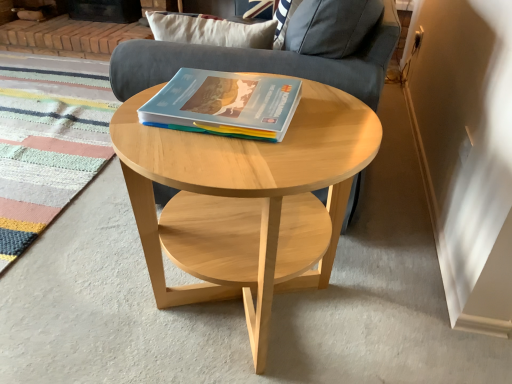
This screenshot has width=512, height=384. Describe the element at coordinates (281, 52) in the screenshot. I see `gray fabric armchair at center` at that location.

Find the location of a particular element. multicolored woven mat at lower left is located at coordinates (48, 140).

Identify the location of matte plastic book at center. (224, 104).

Are multicolored woven mat at lower left and gray fabric armchair at center located far from each other?

Yes.

Which of these two, multicolored woven mat at lower left or gray fabric armchair at center, stands taller?

gray fabric armchair at center is taller.

Is multicolored woven mat at lower left facing towards gray fabric armchair at center?

No, multicolored woven mat at lower left does not turn towards gray fabric armchair at center.

In terms of size, does multicolored woven mat at lower left appear bigger or smaller than gray fabric armchair at center?

Considering their sizes, multicolored woven mat at lower left takes up less space than gray fabric armchair at center.

Considering the positions of objects matte plastic book at center and multicolored woven mat at lower left in the image provided, who is in front, matte plastic book at center or multicolored woven mat at lower left?

Positioned in front is matte plastic book at center.

Who is taller, matte plastic book at center or multicolored woven mat at lower left?

matte plastic book at center is taller.

Between matte plastic book at center and multicolored woven mat at lower left, which one appears on the right side from the viewer's perspective?

matte plastic book at center is more to the right.

From the picture: Is natural wood coffee table at center oriented away from matte plastic book at center?

No, natural wood coffee table at center's orientation is not away from matte plastic book at center.

From a real-world perspective, is natural wood coffee table at center beneath matte plastic book at center?

Yes.

Between multicolored woven mat at lower left and natural wood coffee table at center, which one has smaller size?

multicolored woven mat at lower left.

Is multicolored woven mat at lower left facing away from natural wood coffee table at center?

No.

Is multicolored woven mat at lower left wider than natural wood coffee table at center?

Yes, multicolored woven mat at lower left is wider than natural wood coffee table at center.

Which object is more forward, multicolored woven mat at lower left or natural wood coffee table at center?

natural wood coffee table at center.

From the image's perspective, who appears lower, gray fabric armchair at center or matte plastic book at center?

From the image's view, matte plastic book at center is below.

Identify the location of book above the gray fabric armchair at center (from a real-world perspective). This screenshot has width=512, height=384. (224, 104).

Can you confirm if gray fabric armchair at center is positioned to the right of matte plastic book at center?

Indeed, gray fabric armchair at center is positioned on the right side of matte plastic book at center.

From the picture: Does gray fabric armchair at center have a greater height compared to matte plastic book at center?

Correct, gray fabric armchair at center is much taller as matte plastic book at center.

Which object is wider, natural wood coffee table at center or gray fabric armchair at center?

With larger width is gray fabric armchair at center.

From the image's perspective, between natural wood coffee table at center and gray fabric armchair at center, who is located below?

natural wood coffee table at center.

This screenshot has width=512, height=384. I want to click on coffee table on the left of gray fabric armchair at center, so click(246, 202).

Does natural wood coffee table at center come in front of gray fabric armchair at center?

Yes, natural wood coffee table at center is in front of gray fabric armchair at center.

Is matte plastic book at center inside the boundaries of gray fabric armchair at center, or outside?

matte plastic book at center is spatially situated outside gray fabric armchair at center.

Which is nearer, (153, 126) or (153, 52)?

Point (153, 126) is positioned closer to the camera compared to point (153, 52).

From a real-world perspective, who is located higher, matte plastic book at center or gray fabric armchair at center?

matte plastic book at center, from a real-world perspective.

Based on their sizes in the image, would you say matte plastic book at center is bigger or smaller than gray fabric armchair at center?

matte plastic book at center is smaller than gray fabric armchair at center.

Locate an element on the screen. This screenshot has height=384, width=512. mat below the gray fabric armchair at center (from the image's perspective) is located at coordinates (48, 140).

Where is `mat that is above the matte plastic book at center (from the image's perspective)`? mat that is above the matte plastic book at center (from the image's perspective) is located at coordinates (48, 140).

From the image, which object appears to be farther from matte plastic book at center, natural wood coffee table at center or gray fabric armchair at center?

The object further to matte plastic book at center is gray fabric armchair at center.

In the scene shown: Which object lies further to the anchor point matte plastic book at center, multicolored woven mat at lower left or natural wood coffee table at center?

multicolored woven mat at lower left is positioned further to the anchor matte plastic book at center.

Looking at the image, which one is located closer to multicolored woven mat at lower left, matte plastic book at center or gray fabric armchair at center?

Among the two, gray fabric armchair at center is located nearer to multicolored woven mat at lower left.

Based on their spatial positions, is matte plastic book at center or natural wood coffee table at center closer to multicolored woven mat at lower left?

Among the two, natural wood coffee table at center is located nearer to multicolored woven mat at lower left.

From the image, which object appears to be nearer to gray fabric armchair at center, matte plastic book at center or multicolored woven mat at lower left?

→ matte plastic book at center is closer to gray fabric armchair at center.

Estimate the real-world distances between objects in this image. Which object is closer to multicolored woven mat at lower left, gray fabric armchair at center or matte plastic book at center?

Based on the image, gray fabric armchair at center appears to be nearer to multicolored woven mat at lower left.

Estimate the real-world distances between objects in this image. Which object is further from multicolored woven mat at lower left, natural wood coffee table at center or matte plastic book at center?

Based on the image, matte plastic book at center appears to be further to multicolored woven mat at lower left.

Looking at the image, which one is located closer to gray fabric armchair at center, natural wood coffee table at center or multicolored woven mat at lower left?

natural wood coffee table at center lies closer to gray fabric armchair at center than the other object.

Identify the location of book situated between multicolored woven mat at lower left and natural wood coffee table at center from left to right. The height and width of the screenshot is (384, 512). (224, 104).

Identify the location of book between gray fabric armchair at center and natural wood coffee table at center from top to bottom. (224, 104).

Where is `book between multicolored woven mat at lower left and gray fabric armchair at center in the horizontal direction`? This screenshot has width=512, height=384. book between multicolored woven mat at lower left and gray fabric armchair at center in the horizontal direction is located at coordinates (224, 104).

Where is `coffee table between multicolored woven mat at lower left and gray fabric armchair at center from left to right`? coffee table between multicolored woven mat at lower left and gray fabric armchair at center from left to right is located at coordinates (246, 202).